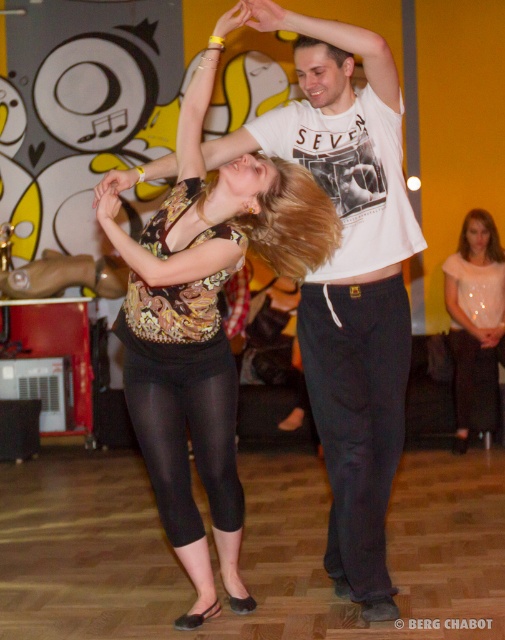
Does matte black leggings at center appear over matte white blouse at lower right?

No, matte black leggings at center is not above matte white blouse at lower right.

The width and height of the screenshot is (505, 640). Find the location of `matte black leggings at center`. matte black leggings at center is located at coordinates (205, 323).

Find the location of a particular element. matte black leggings at center is located at coordinates (205, 323).